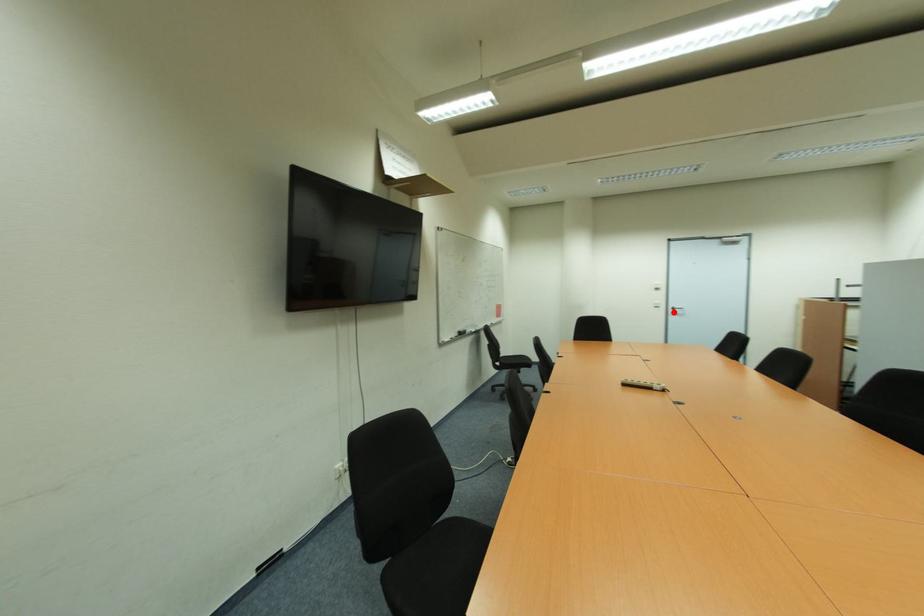
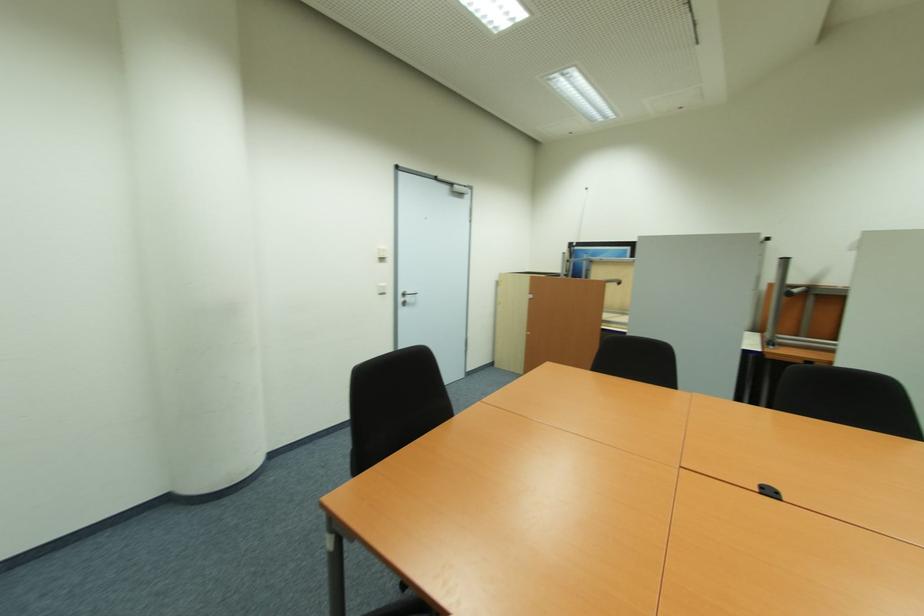
Find the pixel in the second image that matches the highlighted location in the first image.

(405, 300)